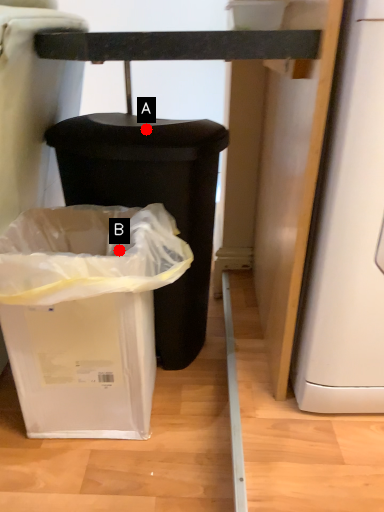
Question: Two points are circled on the image, labeled by A and B beside each circle. Which point is further to the camera?

Choices:
 (A) A is further
 (B) B is further

Answer: (A)